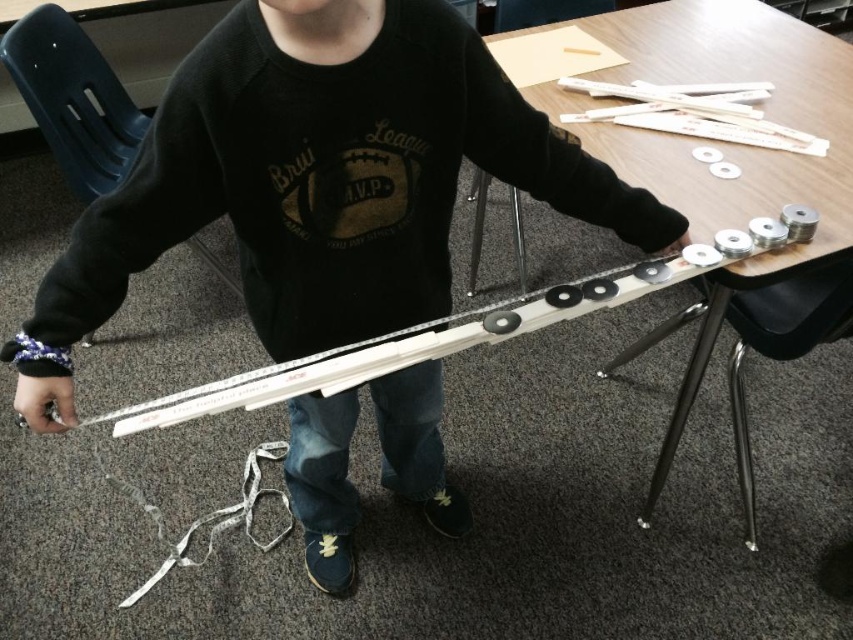
You are an assistant helping someone assemble a project. The person is holding the matte black hand at lower left and needs to place it on the wooden table at center. Can you tell them if the hand is already closer to the table than the table is to you?

The wooden table at center is further to the viewer than the matte black hand at lower left, so the hand is closer to the table than the table is to you.

You are taking a photo of the scene and want to focus on the object part at point (24,388) and point (677,246). Which point should you adjust your camera focus to first?

Point (24,388) is closer to the camera than point (677,246), so you should focus on point (24,388) first.